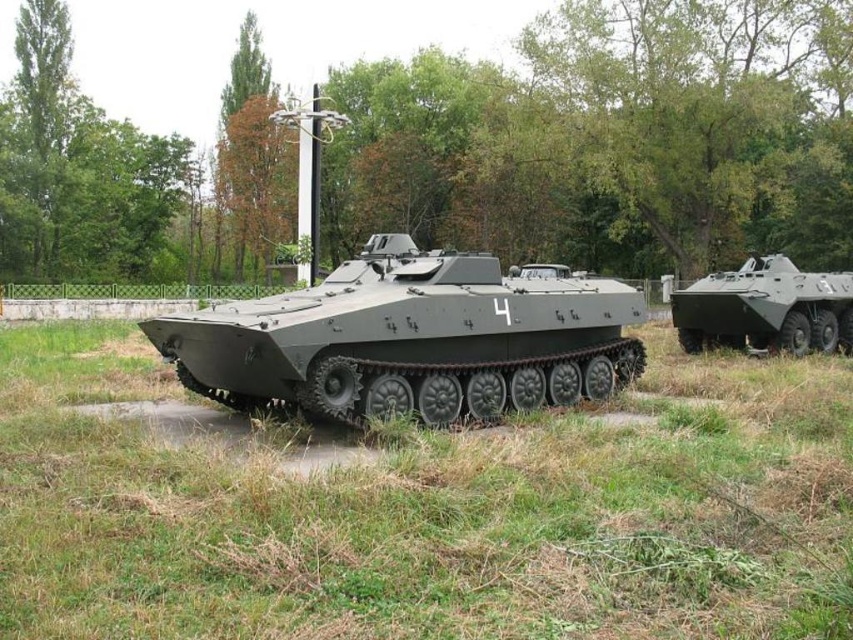
Who is lower down, green matte grass at center or matte green tank at right?

Positioned lower is green matte grass at center.

Is green matte grass at center positioned before matte green tank at right?

Yes, green matte grass at center is closer to the viewer.

This screenshot has height=640, width=853. Describe the element at coordinates (428, 513) in the screenshot. I see `green matte grass at center` at that location.

Find the location of `green matte grass at center`. green matte grass at center is located at coordinates (428, 513).

Is matte gray tank at center to the left of matte green tank at right from the viewer's perspective?

Yes, matte gray tank at center is to the left of matte green tank at right.

Who is taller, matte gray tank at center or matte green tank at right?

matte gray tank at center is taller.

Is point (151, 339) positioned behind point (776, 342)?

No.

Where is `matte gray tank at center`? The image size is (853, 640). matte gray tank at center is located at coordinates (410, 339).

Is point (135, 461) positioned after point (395, 412)?

No, (135, 461) is closer to viewer.

Who is higher up, green matte grass at center or matte gray tank at center?

matte gray tank at center is above.

Find the location of a particular element. The width and height of the screenshot is (853, 640). green matte grass at center is located at coordinates click(428, 513).

Find the location of a particular element. The height and width of the screenshot is (640, 853). green matte grass at center is located at coordinates (428, 513).